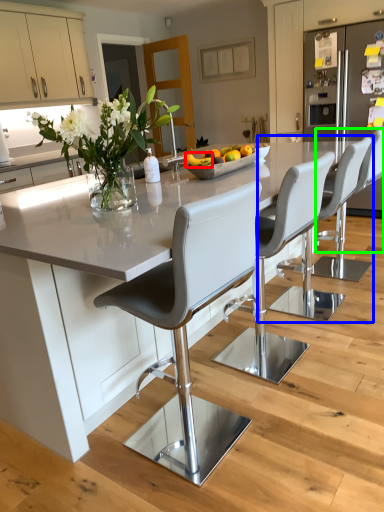
Question: Based on their relative distances, which object is farther from banana (highlighted by a red box)? Choose from chair (highlighted by a blue box) and chair (highlighted by a green box).

Choices:
 (A) chair
 (B) chair

Answer: (A)